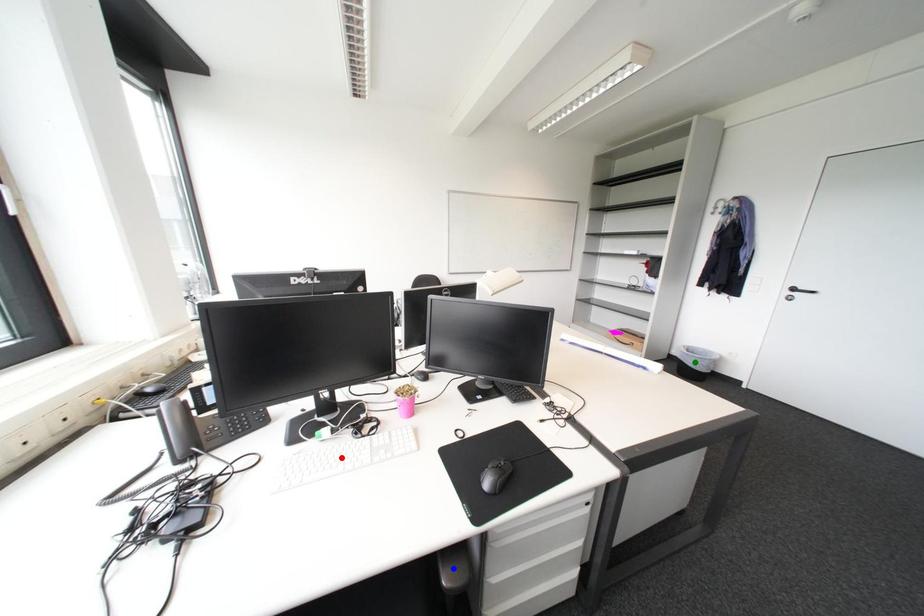
Consider the image. Order these from nearest to farthest:
A) blue point
B) green point
C) red point

green point < red point < blue point